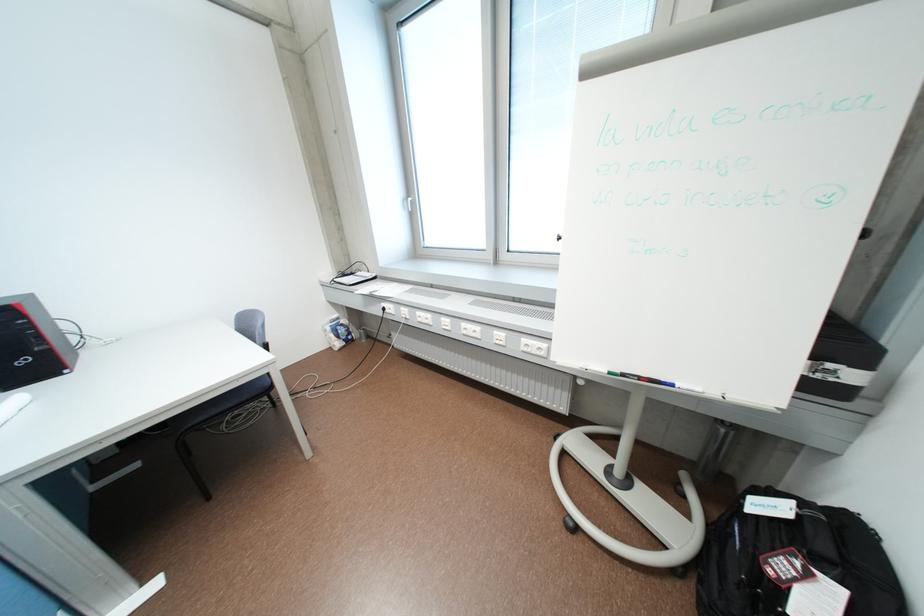
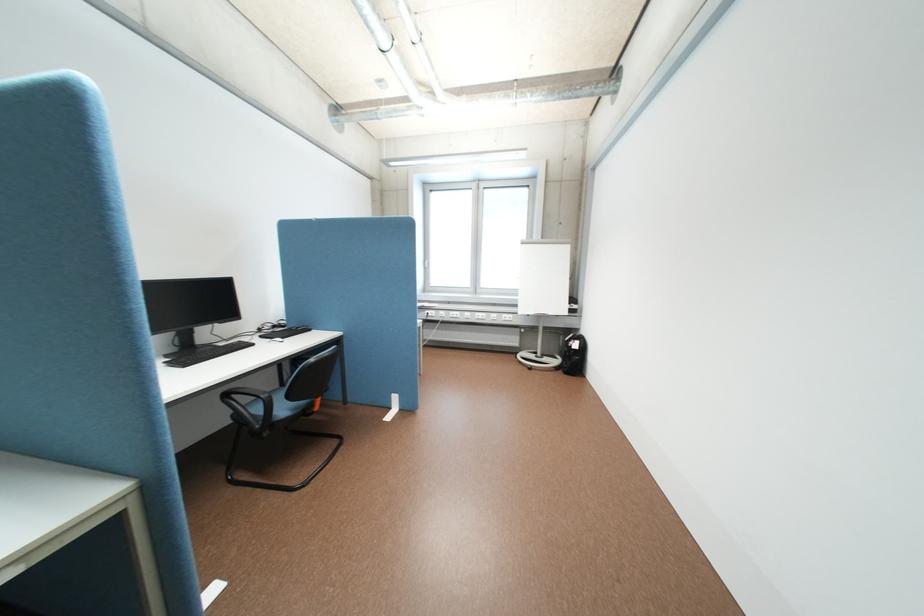
The images are taken continuously from a first-person perspective. In which direction are you moving?

The movement direction of the cameraman is left, backward.